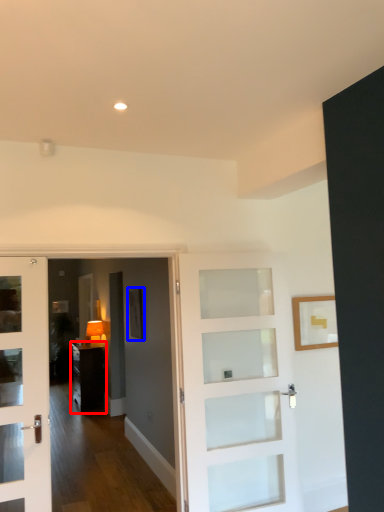
Question: Which object appears farthest to the camera in this image, furniture (highlighted by a red box) or picture frame (highlighted by a blue box)?

Choices:
 (A) furniture
 (B) picture frame

Answer: (A)